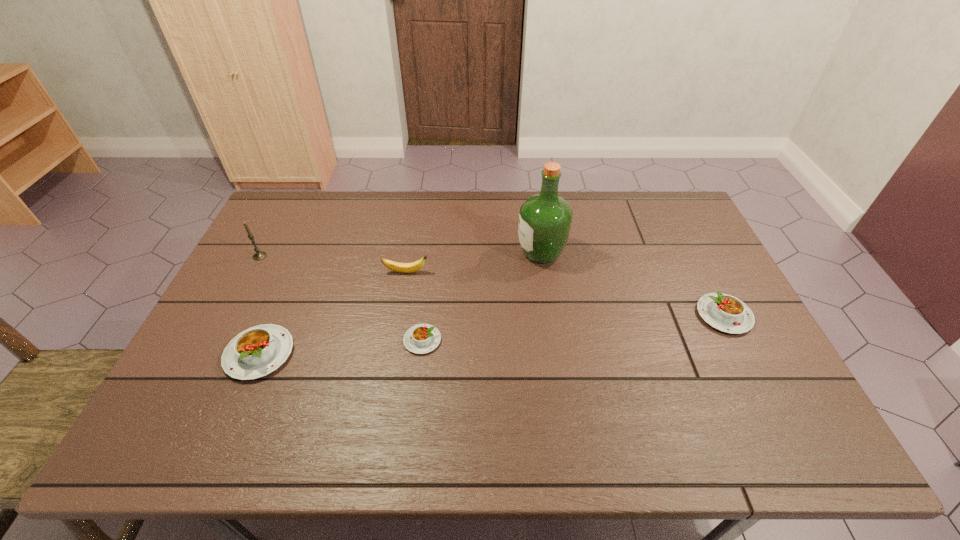
What are the coordinates of `location for an additional pudding to make spacing equal` in the screenshot? It's located at tap(577, 327).